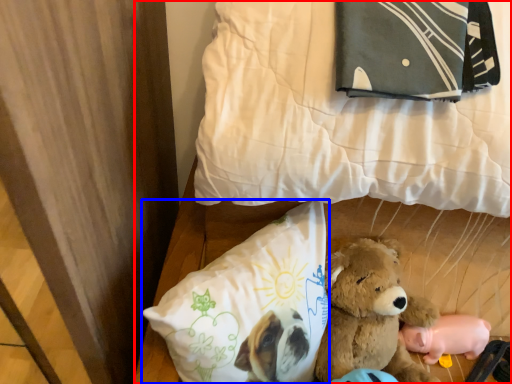
Question: Which of the following is the farthest to the observer, bed (highlighted by a red box) or pillow (highlighted by a blue box)?

Choices:
 (A) bed
 (B) pillow

Answer: (B)